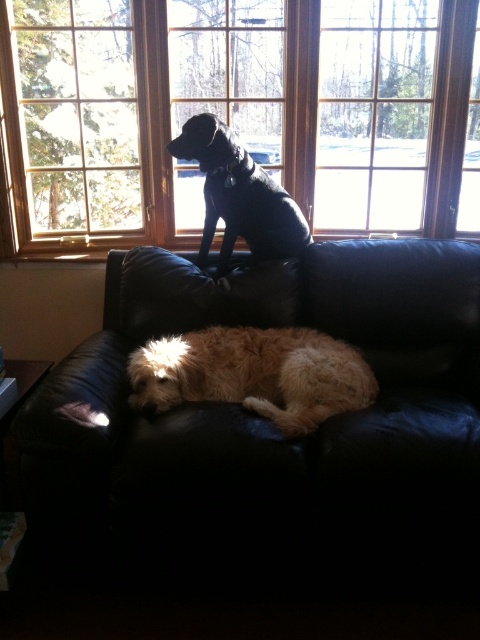
Question: Does black leather couch at lower center lie behind fuzzy golden dog at lower center?

Choices:
 (A) no
 (B) yes

Answer: (A)

Question: Does black leather couch at lower center appear under shiny black dog at upper center?

Choices:
 (A) no
 (B) yes

Answer: (B)

Question: Estimate the real-world distances between objects in this image. Which object is closer to the wooden frame at upper center?

Choices:
 (A) fuzzy golden dog at lower center
 (B) black leather couch at lower center
 (C) shiny black dog at upper center

Answer: (C)

Question: Which of these objects is positioned closest to the black leather couch at lower center?

Choices:
 (A) wooden frame at upper center
 (B) shiny black dog at upper center
 (C) fuzzy golden dog at lower center

Answer: (C)

Question: Is black leather couch at lower center positioned in front of wooden frame at upper center?

Choices:
 (A) no
 (B) yes

Answer: (B)

Question: Among these points, which one is nearest to the camera?

Choices:
 (A) (168, 296)
 (B) (310, 355)
 (C) (265, 250)

Answer: (B)